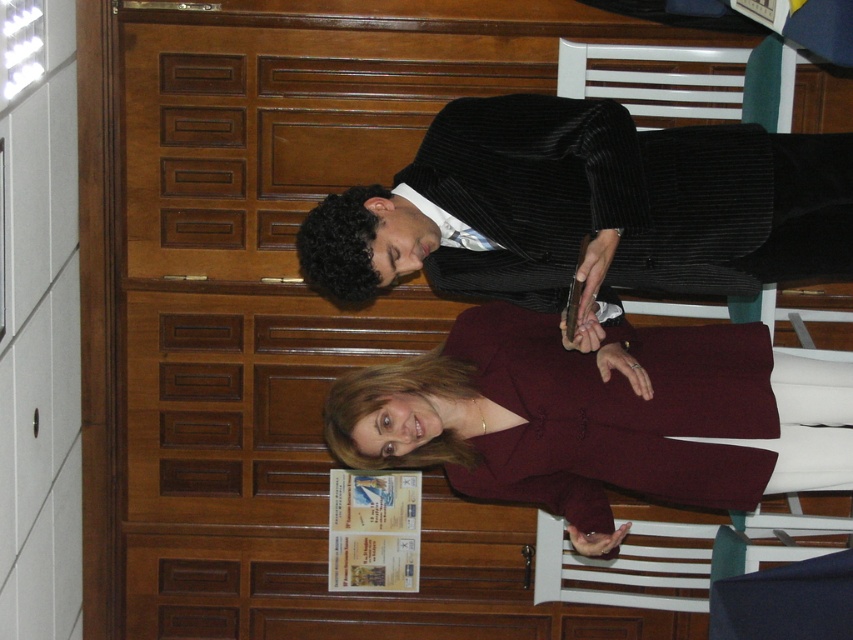
Who is lower down, black corduroy suit at center or burgundy fabric coat at center?

burgundy fabric coat at center is lower down.

Between point (770, 211) and point (579, 365), which one is positioned behind?

Point (579, 365)

Locate an element on the screen. Image resolution: width=853 pixels, height=640 pixels. black corduroy suit at center is located at coordinates (590, 205).

How much distance is there between black corduroy suit at center and white plastic chair at center?

They are 4.99 feet apart.

Consider the image. Is black corduroy suit at center below white plastic chair at center?

No, black corduroy suit at center is not below white plastic chair at center.

Which is in front, point (769, 196) or point (560, 552)?

Positioned in front is point (769, 196).

This screenshot has width=853, height=640. I want to click on black corduroy suit at center, so click(590, 205).

In the scene shown: Does burgundy fabric coat at center appear on the right side of white plastic chair at center?

Incorrect, burgundy fabric coat at center is not on the right side of white plastic chair at center.

Which is above, burgundy fabric coat at center or white plastic chair at center?

burgundy fabric coat at center is higher up.

This screenshot has width=853, height=640. Identify the location of burgundy fabric coat at center. (567, 416).

Find the location of a particular element. The height and width of the screenshot is (640, 853). burgundy fabric coat at center is located at coordinates (567, 416).